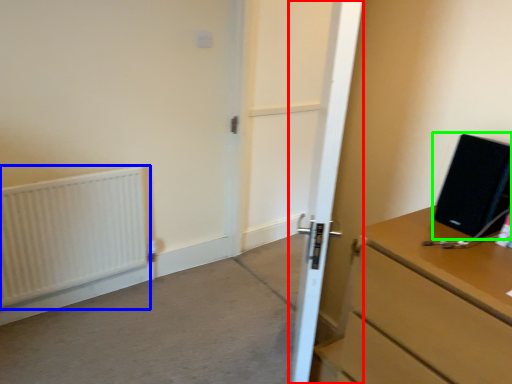
Question: Which object is the closest to the door (highlighted by a red box)? Choose among these: radiator (highlighted by a blue box) or desktop computer (highlighted by a green box).

Choices:
 (A) radiator
 (B) desktop computer

Answer: (B)